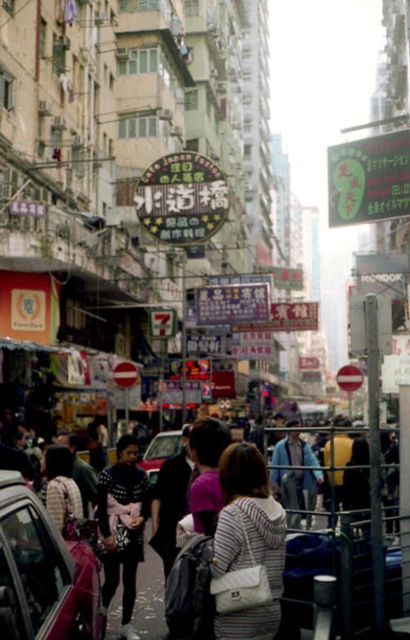
Question: Is black knit sweater at center thinner than metallic silver car at center?

Choices:
 (A) no
 (B) yes

Answer: (B)

Question: Does metallic red car at lower left appear over black knit sweater at center?

Choices:
 (A) yes
 (B) no

Answer: (A)

Question: Which object appears farthest from the camera in this image?

Choices:
 (A) metallic red car at lower left
 (B) black knit sweater at center
 (C) metallic silver car at center
 (D) white quilted purse at center

Answer: (C)

Question: Is striped fabric crowd at center positioned in front of white quilted purse at center?

Choices:
 (A) yes
 (B) no

Answer: (A)

Question: Which point is farther to the camera?

Choices:
 (A) metallic red car at lower left
 (B) white quilted purse at center
 (C) black knit sweater at center

Answer: (B)

Question: Estimate the real-world distances between objects in this image. Which object is farther from the metallic red car at lower left?

Choices:
 (A) white quilted purse at center
 (B) striped fabric crowd at center
 (C) metallic silver car at center
 (D) black knit sweater at center

Answer: (C)